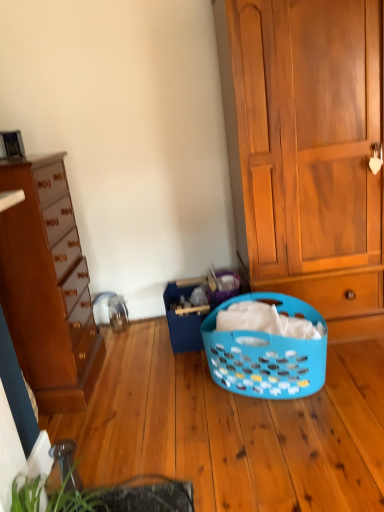
Measure the distance between point (207, 313) and camera.

Point (207, 313) is 8.00 feet away from camera.

How much space does wooden cabinet at right, which is counted as the 1th cabinetry, starting from the right, occupy horizontally?

23.90 inches.

Where is `blue plastic laundry basket at center`? blue plastic laundry basket at center is located at coordinates (266, 353).

The height and width of the screenshot is (512, 384). What do you see at coordinates (47, 286) in the screenshot?
I see `matte brown dresser at left, the 1th cabinetry viewed from the left` at bounding box center [47, 286].

The image size is (384, 512). What are the coordinates of `blue plastic laundry basket at center` in the screenshot? It's located at (191, 313).

Looking at their sizes, would you say green leafy plant at lower left is wider or thinner than blue plastic laundry basket at center?

Clearly, green leafy plant at lower left has more width compared to blue plastic laundry basket at center.

Is point (65, 509) behind point (187, 319)?

No.

Which object is positioned more to the left, green leafy plant at lower left or blue plastic laundry basket at center?

From the viewer's perspective, green leafy plant at lower left appears more on the left side.

Considering the sizes of objects green leafy plant at lower left and blue plastic laundry basket at center in the image provided, who is shorter, green leafy plant at lower left or blue plastic laundry basket at center?

blue plastic laundry basket at center is shorter.

From the image's perspective, is matte brown dresser at left, the 1th cabinetry viewed from the left, under blue plastic laundry basket at center?

Incorrect, from the image's perspective, matte brown dresser at left, the 1th cabinetry viewed from the left, is higher than blue plastic laundry basket at center.

In the scene shown: Could blue plastic laundry basket at center be considered to be inside matte brown dresser at left, the 1th cabinetry viewed from the left?

No.

Is matte brown dresser at left, the 1th cabinetry viewed from the left, oriented away from blue plastic laundry basket at center?

matte brown dresser at left, the 1th cabinetry viewed from the left, does not have its back to blue plastic laundry basket at center.

Which is in front, point (172, 300) or point (28, 322)?

Point (28, 322)

What's the angular difference between blue plastic laundry basket at center and matte brown dresser at left, the 1th cabinetry viewed from the left,'s facing directions?

The angle between the facing direction of blue plastic laundry basket at center and the facing direction of matte brown dresser at left, the 1th cabinetry viewed from the left, is 87.1 degrees.

Between blue plastic laundry basket at center and matte brown dresser at left, the 1th cabinetry viewed from the left, which one has smaller width?

blue plastic laundry basket at center is thinner.

Is matte brown dresser at left, the 2th cabinetry viewed from the right, completely or partially inside blue plastic laundry basket at center?

No.

What's the angular difference between blue plastic laundry basket at center and blue plastic laundry basket at center's facing directions?

blue plastic laundry basket at center and blue plastic laundry basket at center are facing 49.6 degrees away from each other.

Is blue plastic laundry basket at center taller or shorter than blue plastic laundry basket at center?

Clearly, blue plastic laundry basket at center is taller compared to blue plastic laundry basket at center.

Which is correct: blue plastic laundry basket at center is inside blue plastic laundry basket at center, or outside of it?

blue plastic laundry basket at center lies outside blue plastic laundry basket at center.

Is blue plastic laundry basket at center behind blue plastic laundry basket at center?

Yes, blue plastic laundry basket at center is further from the camera.

Between green leafy plant at lower left and matte brown dresser at left, the 2th cabinetry viewed from the right, which one is positioned behind?

matte brown dresser at left, the 2th cabinetry viewed from the right, is further from the camera.

Is green leafy plant at lower left completely or partially outside of matte brown dresser at left, the 2th cabinetry viewed from the right?

Yes, green leafy plant at lower left is outside of matte brown dresser at left, the 2th cabinetry viewed from the right.

Does green leafy plant at lower left turn towards matte brown dresser at left, the 2th cabinetry viewed from the right?

No, green leafy plant at lower left is not oriented towards matte brown dresser at left, the 2th cabinetry viewed from the right.

Does point (61, 504) come farther from viewer compared to point (13, 219)?

No, (61, 504) is in front of (13, 219).

Does green leafy plant at lower left lie behind blue plastic laundry basket at center?

No, green leafy plant at lower left is in front of blue plastic laundry basket at center.

From the image's perspective, is green leafy plant at lower left beneath blue plastic laundry basket at center?

Yes, from the image's perspective, green leafy plant at lower left is below blue plastic laundry basket at center.

Is green leafy plant at lower left inside or outside of blue plastic laundry basket at center?

green leafy plant at lower left lies outside blue plastic laundry basket at center.

Which of these two, green leafy plant at lower left or blue plastic laundry basket at center, is wider?

Wider between the two is blue plastic laundry basket at center.

Would you consider green leafy plant at lower left to be distant from wooden cabinet at right, which is counted as the 1th cabinetry, starting from the right?

Absolutely, green leafy plant at lower left is distant from wooden cabinet at right, which is counted as the 1th cabinetry, starting from the right.

Is wooden cabinet at right, which is counted as the 1th cabinetry, starting from the right, surrounded by green leafy plant at lower left?

No, wooden cabinet at right, which is counted as the 1th cabinetry, starting from the right, is not inside green leafy plant at lower left.

Who is bigger, green leafy plant at lower left or wooden cabinet at right, arranged as the 2th cabinetry when viewed from the left?

wooden cabinet at right, arranged as the 2th cabinetry when viewed from the left, is bigger.

Which object is positioned more to the right, green leafy plant at lower left or wooden cabinet at right, arranged as the 2th cabinetry when viewed from the left?

wooden cabinet at right, arranged as the 2th cabinetry when viewed from the left.

Where is `plant that is below the blue plastic laundry basket at center (from the image's perspective)`? plant that is below the blue plastic laundry basket at center (from the image's perspective) is located at coordinates (124, 496).

What are the coordinates of `shopping basket located on the right of matte brown dresser at left, the 1th cabinetry viewed from the left` in the screenshot? It's located at (191, 313).

Looking at the image, which one is located closer to wooden cabinet at right, arranged as the 2th cabinetry when viewed from the left, green leafy plant at lower left or blue plastic laundry basket at center?

The object closer to wooden cabinet at right, arranged as the 2th cabinetry when viewed from the left, is blue plastic laundry basket at center.

When comparing their distances from blue plastic laundry basket at center, does matte brown dresser at left, the 2th cabinetry viewed from the right, or green leafy plant at lower left seem closer?

green leafy plant at lower left is positioned closer to the anchor blue plastic laundry basket at center.

Which object lies further to the anchor point wooden cabinet at right, arranged as the 2th cabinetry when viewed from the left, matte brown dresser at left, the 2th cabinetry viewed from the right, or blue plastic laundry basket at center?

matte brown dresser at left, the 2th cabinetry viewed from the right.

Looking at the image, which one is located further to green leafy plant at lower left, blue plastic laundry basket at center or matte brown dresser at left, the 2th cabinetry viewed from the right?

blue plastic laundry basket at center lies further to green leafy plant at lower left than the other object.

Which object lies further to the anchor point green leafy plant at lower left, blue plastic laundry basket at center or blue plastic laundry basket at center?

Among the two, blue plastic laundry basket at center is located further to green leafy plant at lower left.

Considering their positions, is wooden cabinet at right, arranged as the 2th cabinetry when viewed from the left, positioned further to blue plastic laundry basket at center than blue plastic laundry basket at center?

The object further to blue plastic laundry basket at center is wooden cabinet at right, arranged as the 2th cabinetry when viewed from the left.

When comparing their distances from matte brown dresser at left, the 2th cabinetry viewed from the right, does blue plastic laundry basket at center or blue plastic laundry basket at center seem closer?

blue plastic laundry basket at center lies closer to matte brown dresser at left, the 2th cabinetry viewed from the right, than the other object.

Looking at the image, which one is located further to blue plastic laundry basket at center, green leafy plant at lower left or blue plastic laundry basket at center?

green leafy plant at lower left.

The width and height of the screenshot is (384, 512). In order to click on plant between matte brown dresser at left, the 1th cabinetry viewed from the left, and blue plastic laundry basket at center from left to right in this screenshot , I will do `click(124, 496)`.

At what (x,y) coordinates should I click in order to perform the action: click on shopping basket between matte brown dresser at left, the 2th cabinetry viewed from the right, and wooden cabinet at right, which is counted as the 1th cabinetry, starting from the right. Please return your answer as a coordinate pair (x, y). The height and width of the screenshot is (512, 384). Looking at the image, I should click on (191, 313).

The height and width of the screenshot is (512, 384). I want to click on shopping basket between wooden cabinet at right, which is counted as the 1th cabinetry, starting from the right, and blue plastic laundry basket at center in the up-down direction, so click(x=191, y=313).

You are a GUI agent. You are given a task and a screenshot of the screen. Output one action in this format:
    pyautogui.click(x=<x>, y=<y>)
    Task: Click on the picnic basket between wooden cabinet at right, arranged as the 2th cabinetry when viewed from the left, and green leafy plant at lower left, in the vertical direction
    
    Given the screenshot: What is the action you would take?
    pyautogui.click(x=266, y=353)